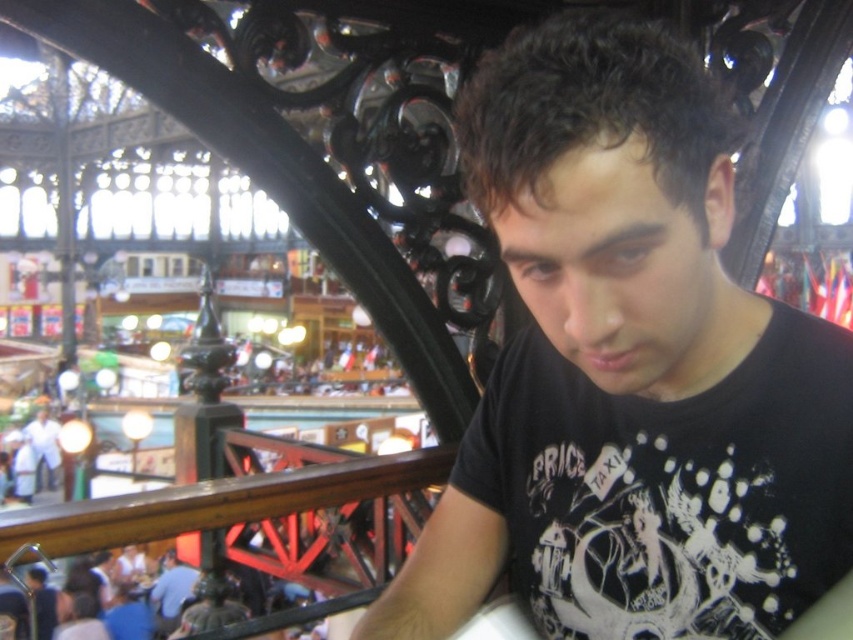
Who is taller, blue shirt at lower left or white cotton shirt at lower left?

white cotton shirt at lower left

Locate an element on the screen. The image size is (853, 640). blue shirt at lower left is located at coordinates 171,593.

Locate an element on the screen. The width and height of the screenshot is (853, 640). blue shirt at lower left is located at coordinates (171, 593).

Between black matte shirt at center and white cotton shirt at lower left, which one is positioned lower?

Positioned lower is white cotton shirt at lower left.

Which is behind, point (596, 534) or point (39, 438)?

Point (39, 438)

Locate an element on the screen. This screenshot has height=640, width=853. black matte shirt at center is located at coordinates pos(630,369).

Describe the element at coordinates (630, 369) in the screenshot. This screenshot has width=853, height=640. I see `black matte shirt at center` at that location.

Who is more distant from viewer, (625, 298) or (177, 621)?

The point (177, 621) is behind.

Does point (590, 554) lie in front of point (167, 561)?

Yes, it is in front of point (167, 561).

Image resolution: width=853 pixels, height=640 pixels. I want to click on black matte shirt at center, so click(630, 369).